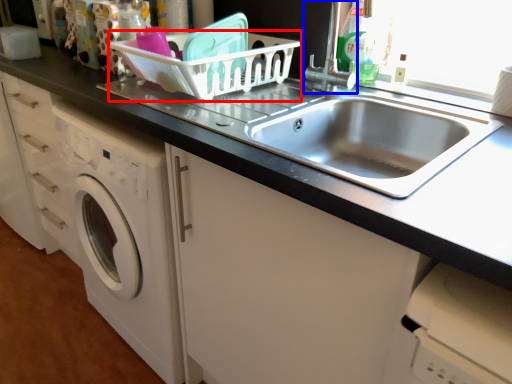
Question: Which object appears farthest to the camera in this image, basket (highlighted by a red box) or faucet (highlighted by a blue box)?

Choices:
 (A) basket
 (B) faucet

Answer: (B)